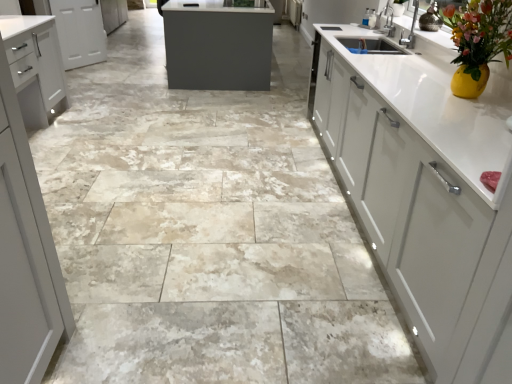
You are a GUI agent. You are given a task and a screenshot of the screen. Output one action in this format:
    pyautogui.click(x=<x>, y=<y>)
    Task: Click on the vacant area that lies to the right of white matte cabinet at upper left, the 2th cabinetry when ordered from front to back
    The image size is (512, 384).
    Given the screenshot: What is the action you would take?
    pyautogui.click(x=115, y=68)